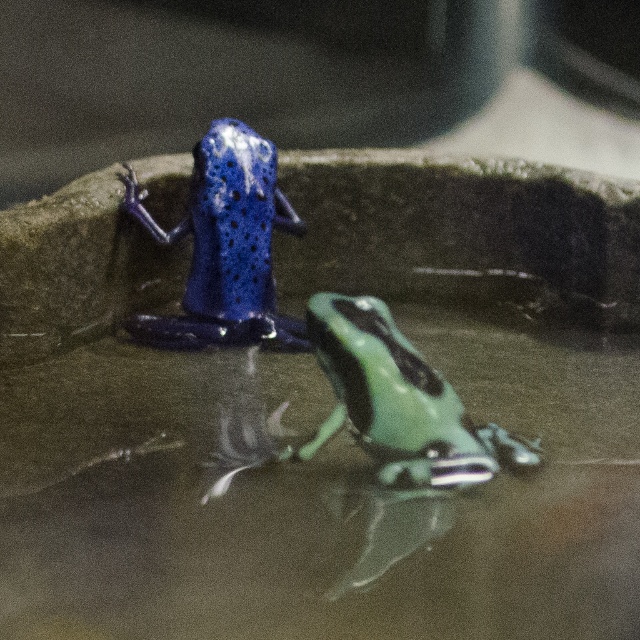
Question: Is shiny blue dart frog at upper left above green matte tree frog at center?

Choices:
 (A) yes
 (B) no

Answer: (A)

Question: Is shiny blue dart frog at upper left thinner than green matte tree frog at center?

Choices:
 (A) yes
 (B) no

Answer: (A)

Question: Among these points, which one is farthest from the camera?

Choices:
 (A) (371, 401)
 (B) (268, 205)

Answer: (B)

Question: Which point is closer to the camera?

Choices:
 (A) shiny blue dart frog at upper left
 (B) green matte tree frog at center

Answer: (B)

Question: Can you confirm if shiny blue dart frog at upper left is smaller than green matte tree frog at center?

Choices:
 (A) yes
 (B) no

Answer: (A)